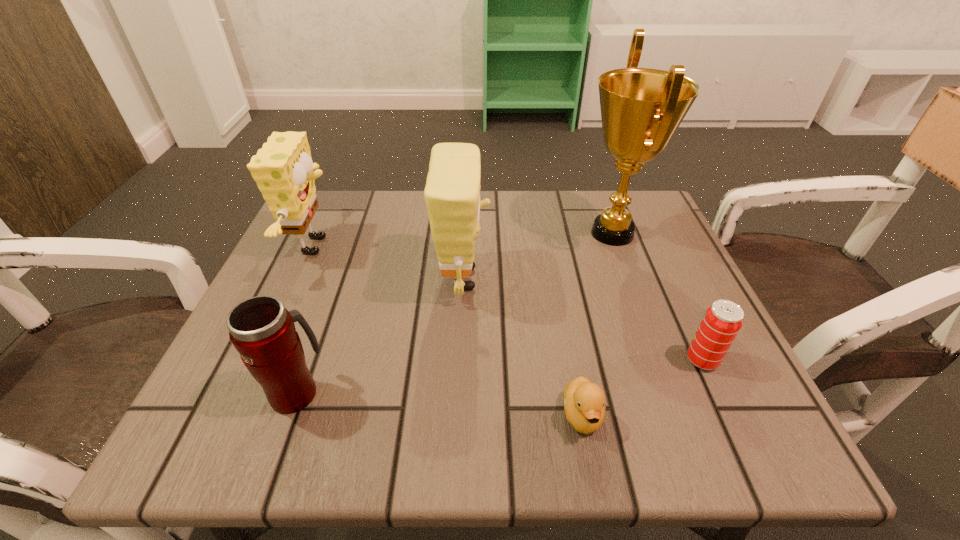
Locate an element on the screen. The height and width of the screenshot is (540, 960). vacant space located on the face of the third object from left to right is located at coordinates (628, 279).

Where is `free space located on the front-facing side of the left sponge`? The height and width of the screenshot is (540, 960). free space located on the front-facing side of the left sponge is located at coordinates (464, 245).

Identify the location of vacant region located 0.150m on the side with the handle of the third shortest object. (328, 304).

Find the location of a particular element. vacant space located on the side with the handle of the third shortest object is located at coordinates (321, 323).

Where is `blank area located on the side with the handle of the third shortest object`? This screenshot has width=960, height=540. blank area located on the side with the handle of the third shortest object is located at coordinates pyautogui.click(x=328, y=304).

This screenshot has height=540, width=960. Identify the location of vacant region located on the left of the soda can. (638, 360).

The height and width of the screenshot is (540, 960). I want to click on award that is at the far edge, so click(x=641, y=108).

The height and width of the screenshot is (540, 960). What are the coordinates of `sponge that is at the far edge` in the screenshot? It's located at (283, 169).

Where is `thermos bottle situated at the near edge`? thermos bottle situated at the near edge is located at coordinates (263, 332).

Where is `duckling that is at the near edge`? duckling that is at the near edge is located at coordinates (584, 402).